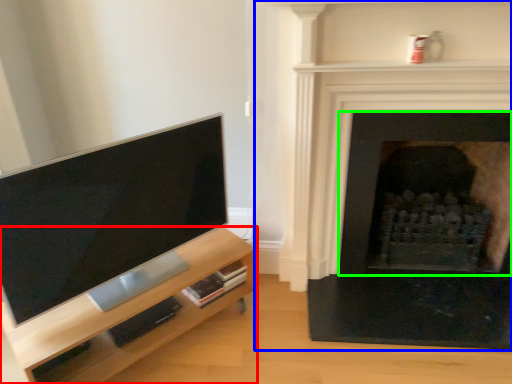
Question: Estimate the real-world distances between objects in this image. Which object is closer to entertainment center (highlighted by a red box), fireplace (highlighted by a blue box) or fireplace (highlighted by a green box)?

Choices:
 (A) fireplace
 (B) fireplace

Answer: (A)